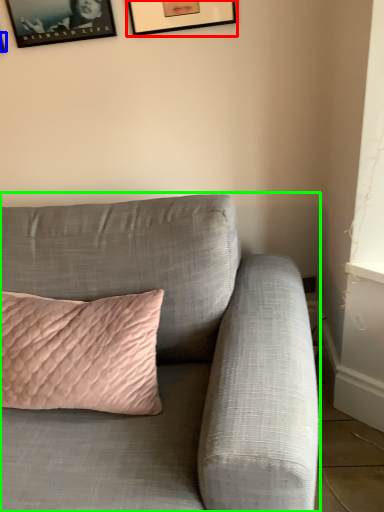
Question: Which is nearer to the picture frame (highlighted by a red box)? picture frame (highlighted by a blue box) or studio couch (highlighted by a green box).

Choices:
 (A) picture frame
 (B) studio couch

Answer: (A)